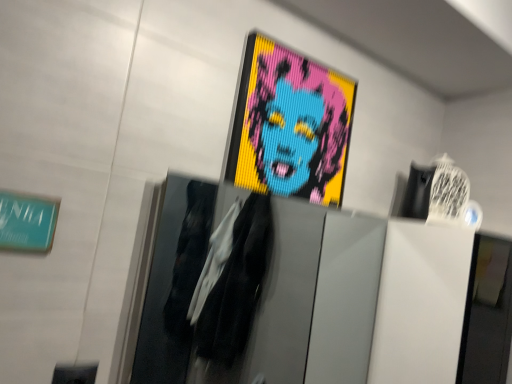
The image size is (512, 384). What do you see at coordinates (27, 221) in the screenshot? I see `teal matte sign at upper left` at bounding box center [27, 221].

The height and width of the screenshot is (384, 512). In order to click on teal matte sign at upper left in this screenshot , I will do `click(27, 221)`.

The width and height of the screenshot is (512, 384). What do you see at coordinates (296, 125) in the screenshot?
I see `pixelated colorful portrait at upper center` at bounding box center [296, 125].

Locate an element on the screen. pixelated colorful portrait at upper center is located at coordinates (296, 125).

Find the location of a particular element. teal matte sign at upper left is located at coordinates (27, 221).

Does teal matte sign at upper left appear on the left side of pixelated colorful portrait at upper center?

Correct, you'll find teal matte sign at upper left to the left of pixelated colorful portrait at upper center.

Looking at this image, is teal matte sign at upper left positioned in front of pixelated colorful portrait at upper center?

Yes, it is in front of pixelated colorful portrait at upper center.

Between point (38, 237) and point (289, 166), which one is positioned in front?

Point (38, 237)

From the image's perspective, which is above, teal matte sign at upper left or pixelated colorful portrait at upper center?

pixelated colorful portrait at upper center, from the image's perspective.

From a real-world perspective, which is physically below, teal matte sign at upper left or pixelated colorful portrait at upper center?

teal matte sign at upper left.

Between teal matte sign at upper left and pixelated colorful portrait at upper center, which one has larger width?

pixelated colorful portrait at upper center is wider.

Considering the sizes of teal matte sign at upper left and pixelated colorful portrait at upper center in the image, is teal matte sign at upper left taller or shorter than pixelated colorful portrait at upper center?

Considering their sizes, teal matte sign at upper left has less height than pixelated colorful portrait at upper center.

Between teal matte sign at upper left and pixelated colorful portrait at upper center, which one has smaller size?

With smaller size is teal matte sign at upper left.

Can pixelated colorful portrait at upper center be found inside teal matte sign at upper left?

No.

Is teal matte sign at upper left placed right next to pixelated colorful portrait at upper center?

teal matte sign at upper left and pixelated colorful portrait at upper center are clearly separated.

Is teal matte sign at upper left facing away from pixelated colorful portrait at upper center?

teal matte sign at upper left does not have its back to pixelated colorful portrait at upper center.

Locate an element on the screen. The width and height of the screenshot is (512, 384). poster on the left of pixelated colorful portrait at upper center is located at coordinates (27, 221).

Consider the image. Considering the positions of objects pixelated colorful portrait at upper center and teal matte sign at upper left in the image provided, who is more to the left, pixelated colorful portrait at upper center or teal matte sign at upper left?

From the viewer's perspective, teal matte sign at upper left appears more on the left side.

From the picture: Relative to teal matte sign at upper left, is pixelated colorful portrait at upper center in front or behind?

In the image, pixelated colorful portrait at upper center appears behind teal matte sign at upper left.

Does point (333, 149) lie behind point (50, 209)?

Yes.

From the image's perspective, is pixelated colorful portrait at upper center below teal matte sign at upper left?

Actually, pixelated colorful portrait at upper center appears above teal matte sign at upper left in the image.

From a real-world perspective, relative to teal matte sign at upper left, is pixelated colorful portrait at upper center vertically above or below?

pixelated colorful portrait at upper center is above teal matte sign at upper left.

Which of these two, pixelated colorful portrait at upper center or teal matte sign at upper left, is thinner?

teal matte sign at upper left.

In the scene shown: From their relative heights in the image, would you say pixelated colorful portrait at upper center is taller or shorter than teal matte sign at upper left?

Considering their sizes, pixelated colorful portrait at upper center has more height than teal matte sign at upper left.

Is pixelated colorful portrait at upper center smaller than teal matte sign at upper left?

Incorrect, pixelated colorful portrait at upper center is not smaller in size than teal matte sign at upper left.

Would you say teal matte sign at upper left is part of pixelated colorful portrait at upper center's contents?

Actually, teal matte sign at upper left is outside pixelated colorful portrait at upper center.

Is pixelated colorful portrait at upper center with teal matte sign at upper left?

No, pixelated colorful portrait at upper center is not in contact with teal matte sign at upper left.

Consider the image. Is teal matte sign at upper left at the back of pixelated colorful portrait at upper center?

No, pixelated colorful portrait at upper center's orientation is not away from teal matte sign at upper left.

At what (x,y) coordinates should I click in order to perform the action: click on poster that is below the pixelated colorful portrait at upper center (from the image's perspective). Please return your answer as a coordinate pair (x, y). This screenshot has width=512, height=384. Looking at the image, I should click on (27, 221).

Where is `poster below the pixelated colorful portrait at upper center (from a real-world perspective)`? The width and height of the screenshot is (512, 384). poster below the pixelated colorful portrait at upper center (from a real-world perspective) is located at coordinates (27, 221).

This screenshot has width=512, height=384. I want to click on person that is on the right side of teal matte sign at upper left, so click(296, 125).